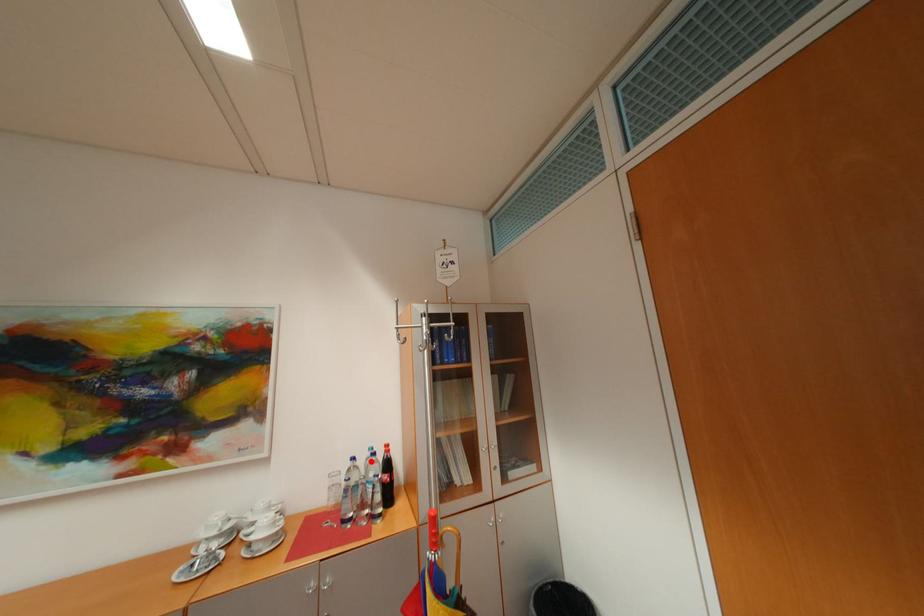
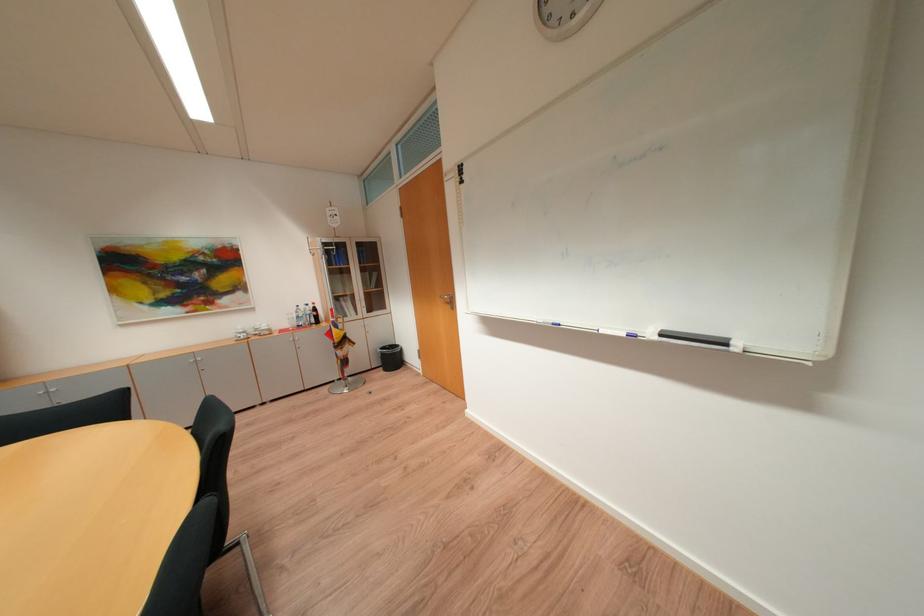
The point at the highlighted location is marked in the first image. Where is the corresponding point in the second image?

(310, 309)